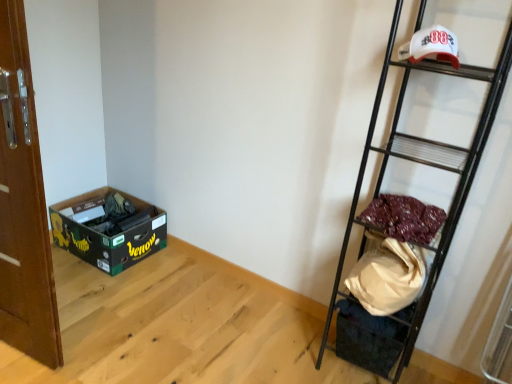
Where is `free space in front of green cardboard box at lower left`? The width and height of the screenshot is (512, 384). free space in front of green cardboard box at lower left is located at coordinates (101, 292).